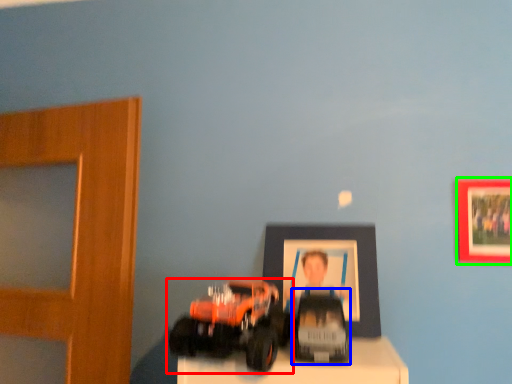
Question: Which object is positioned farthest from toy (highlighted by a red box)? Select from toy (highlighted by a blue box) and picture frame (highlighted by a green box).

Choices:
 (A) toy
 (B) picture frame

Answer: (B)